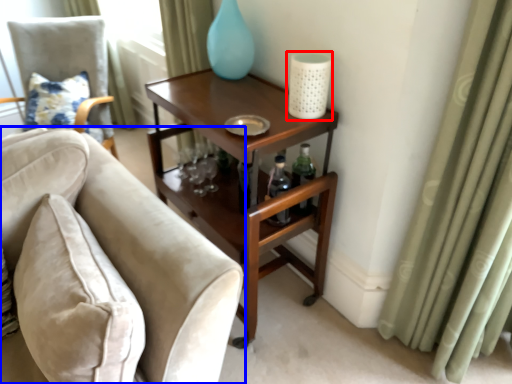
Question: Which point is further to the camera, candle holder (highlighted by a red box) or chair (highlighted by a blue box)?

Choices:
 (A) candle holder
 (B) chair

Answer: (A)